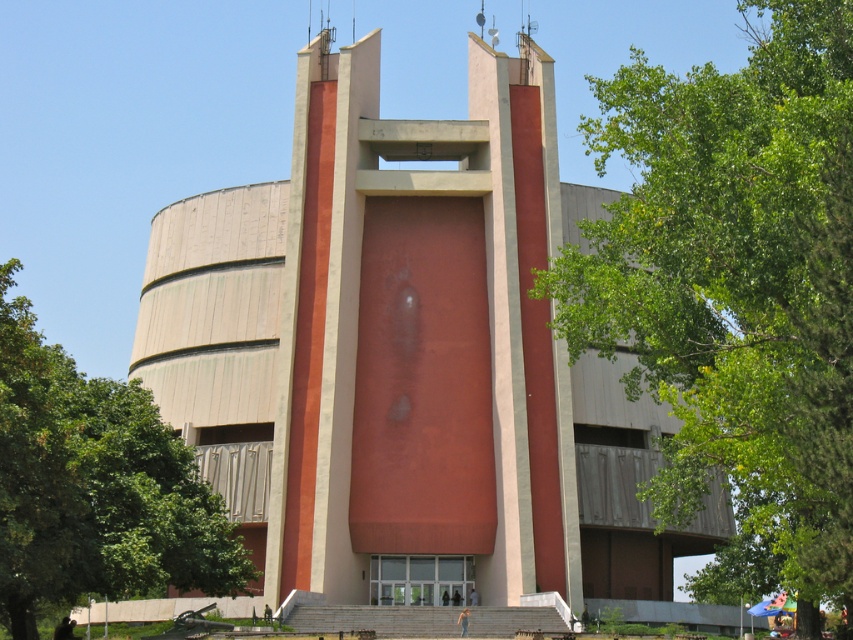
Describe the element at coordinates (735, 291) in the screenshot. This screenshot has height=640, width=853. I see `green leafy tree at center` at that location.

Does green leafy tree at center appear on the left side of green leafy tree at left?

In fact, green leafy tree at center is to the right of green leafy tree at left.

Is point (793, 64) in front of point (149, 486)?

Yes, point (793, 64) is in front of point (149, 486).

At what (x,y) coordinates should I click in order to perform the action: click on green leafy tree at center. Please return your answer as a coordinate pair (x, y). Looking at the image, I should click on (735, 291).